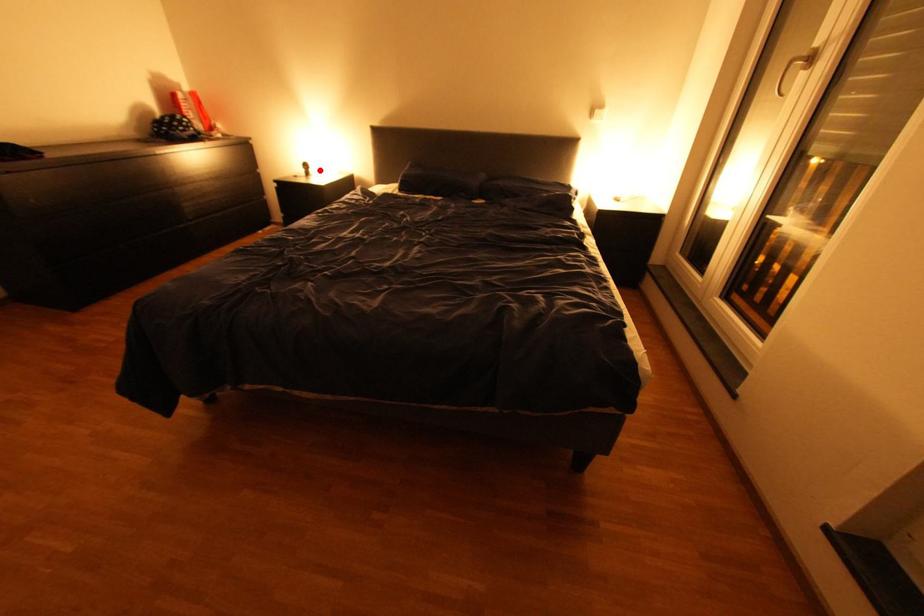
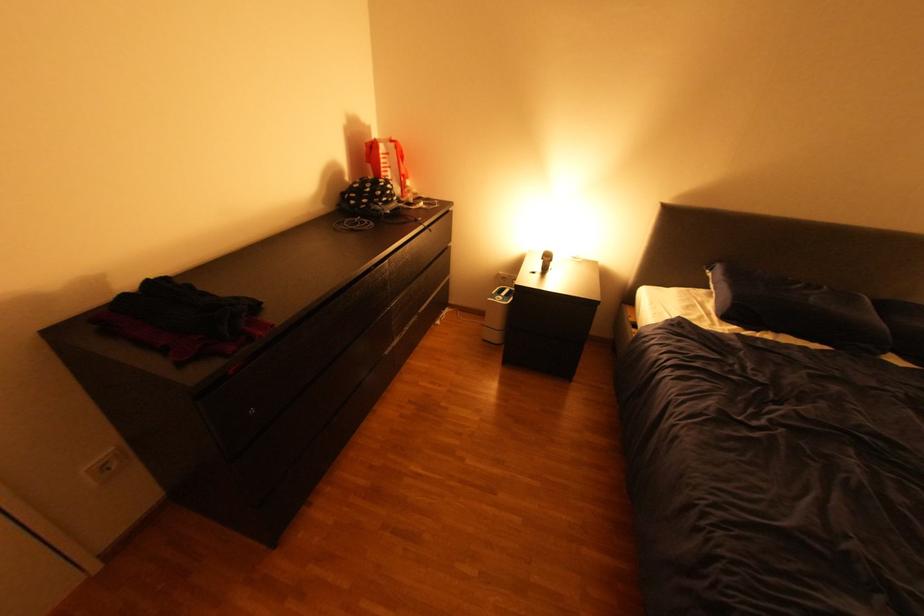
Question: I am providing you with two images of the same scene from different viewpoints. A red point is marked on the first image. Can you still see the location of the red point in image 2?

Choices:
 (A) Yes
 (B) No

Answer: (A)